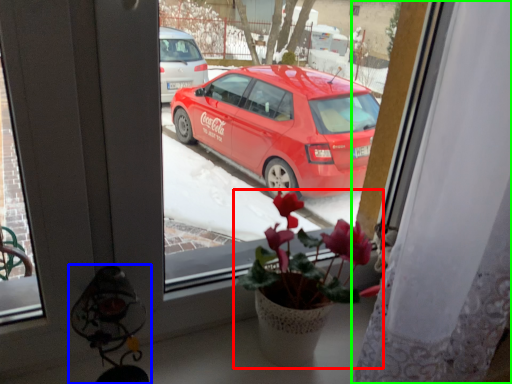
Question: Based on their relative distances, which object is nearer to houseplant (highlighted by a red box)? Choose from lamp (highlighted by a blue box) and curtain (highlighted by a green box).

Choices:
 (A) lamp
 (B) curtain

Answer: (B)